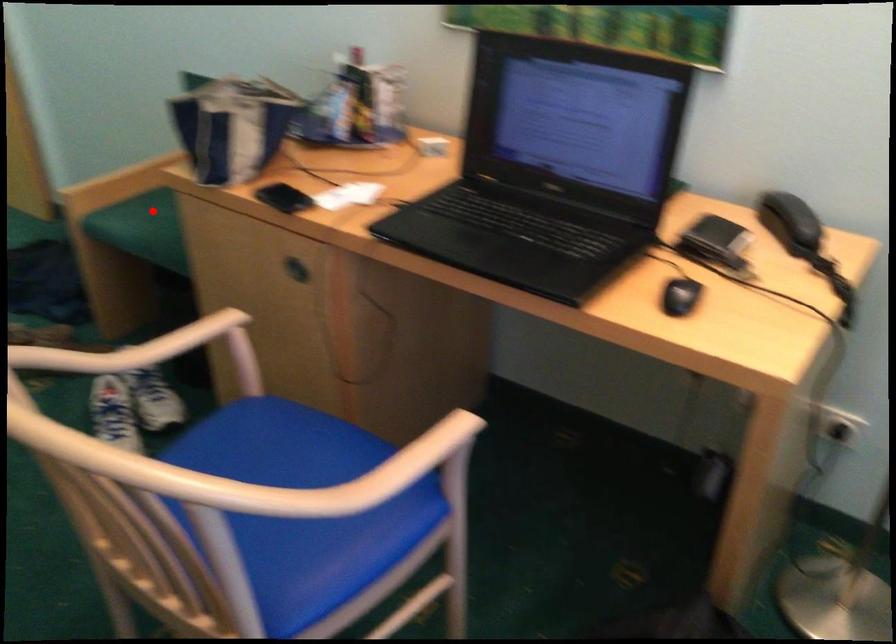
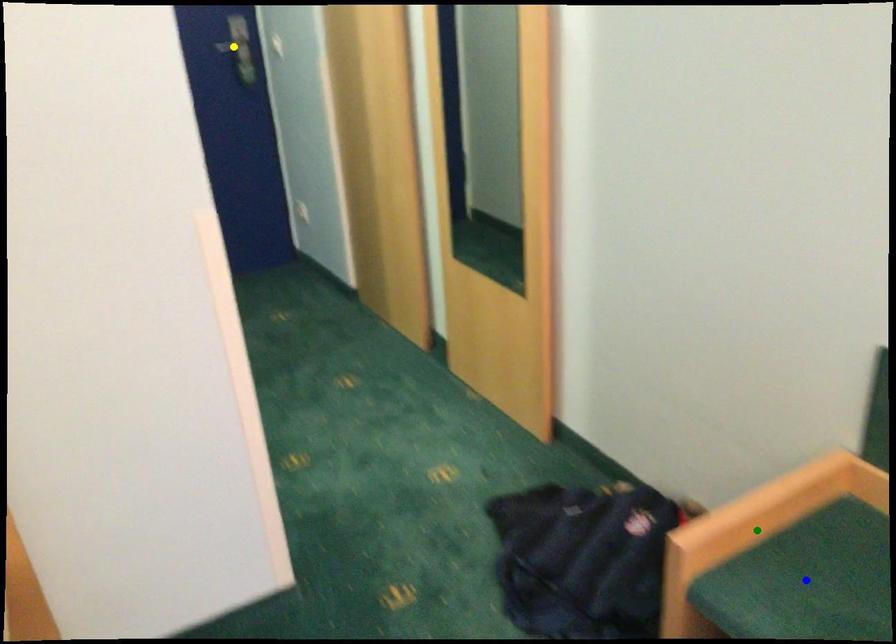
Question: I am providing you with two images of the same scene from different viewpoints. A red point is marked on the first image. You are given multiple points on the second image. In image 2, which mark is for the same physical point as the one in image 1?

Choices:
 (A) green point
 (B) blue point
 (C) yellow point

Answer: (B)